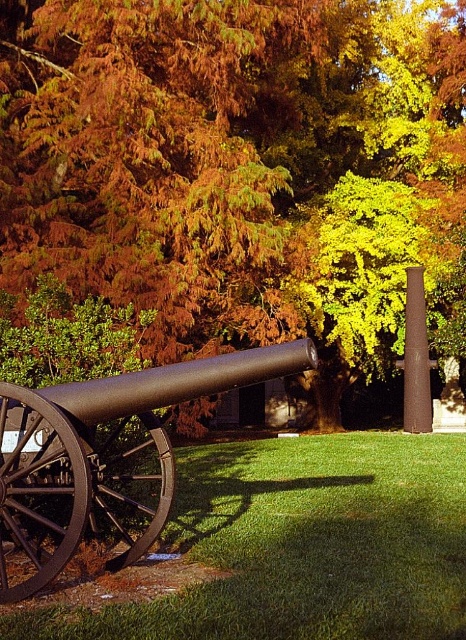
Based on the photo, you are a park ranger who needs to place a new bench between the green grass at lower center and the rusty metal pole at center right. The bench requires a minimum of 5 meters of space to be placed safely. Can you place the bench between these two objects?

The green grass at lower center is 6.05 meters away from the rusty metal pole at center right. Since the required minimum space is 5 meters, the bench can be placed between them as the distance is sufficient.

You are standing at the cannon and looking towards the direction it is pointing. There are two points marked in the image. Which point, point (x=120, y=502) or point (x=424, y=358), is closer to you?

Point (x=120, y=502) is closer to you because it is in front of point (x=424, y=358).

You are standing at the center of the image and want to locate the matte black cannon at lower left. Based on the coordinates provided, in which direction should you look to find it?

The matte black cannon at lower left is located at coordinates point (102, 460), so you should look to the lower left direction to find it.